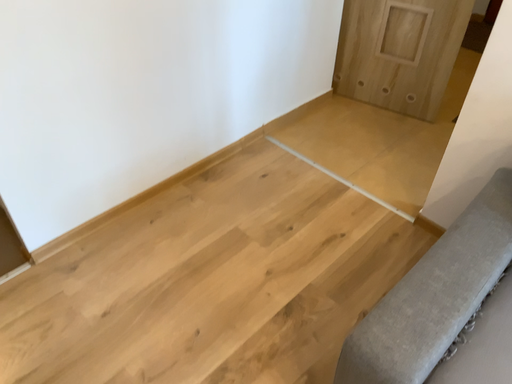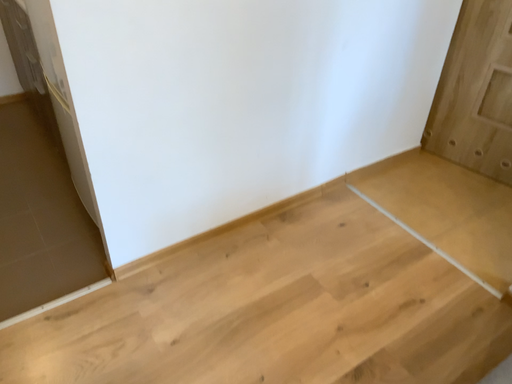
Question: Which way did the camera rotate in the video?

Choices:
 (A) rotated left
 (B) rotated right

Answer: (A)